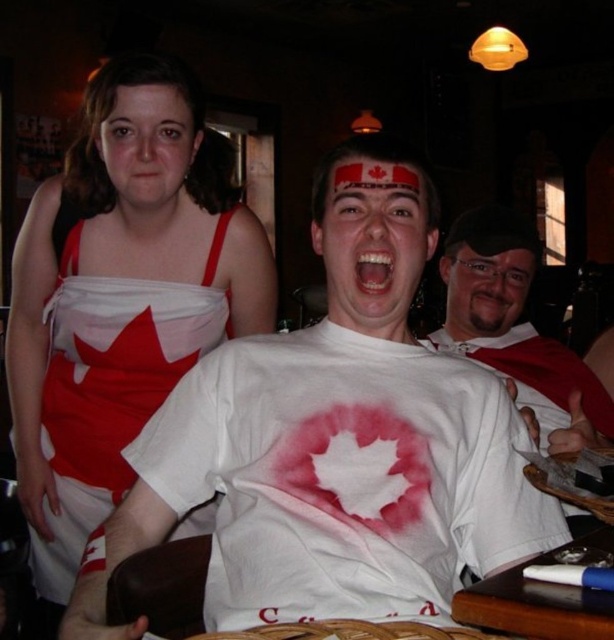
Is matte white face at center taller than matte white face at upper left?

Correct, matte white face at center is much taller as matte white face at upper left.

The width and height of the screenshot is (614, 640). What do you see at coordinates (371, 241) in the screenshot?
I see `matte white face at center` at bounding box center [371, 241].

The image size is (614, 640). In order to click on matte white face at center in this screenshot , I will do `click(371, 241)`.

The height and width of the screenshot is (640, 614). In order to click on matte white face at center in this screenshot , I will do `click(371, 241)`.

Does matte white face at upper left appear under matte plastic face at center?

No.

Can you confirm if matte white face at upper left is taller than matte plastic face at center?

Incorrect, matte white face at upper left's height is not larger of matte plastic face at center's.

Which is in front, point (166, 120) or point (464, 305)?

Point (166, 120) is in front.

Find the location of a particular element. The image size is (614, 640). matte white face at upper left is located at coordinates (147, 145).

How much distance is there between white matte t-shirt at center and matte white face at upper left?

They are 62.13 centimeters apart.

Which is more to the left, white matte t-shirt at center or matte white face at upper left?

From the viewer's perspective, matte white face at upper left appears more on the left side.

Which is in front, point (324, 253) or point (109, 168)?

Point (324, 253) is more forward.

The image size is (614, 640). I want to click on white matte t-shirt at center, so click(x=335, y=440).